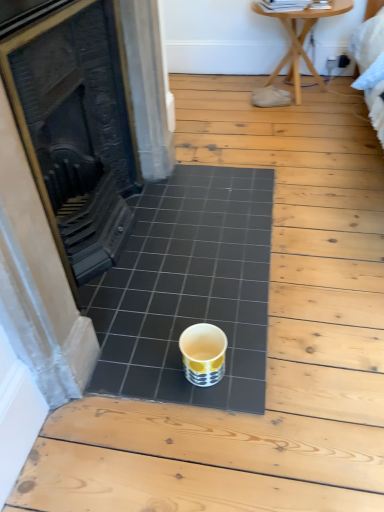
Question: Does black ceramic tile at center have a greater width compared to black cast iron fireplace at center?

Choices:
 (A) no
 (B) yes

Answer: (B)

Question: From the image's perspective, is black ceramic tile at center located beneath black cast iron fireplace at center?

Choices:
 (A) no
 (B) yes

Answer: (B)

Question: Does black ceramic tile at center have a smaller size compared to black cast iron fireplace at center?

Choices:
 (A) no
 (B) yes

Answer: (B)

Question: From the image's perspective, is black ceramic tile at center above black cast iron fireplace at center?

Choices:
 (A) yes
 (B) no

Answer: (B)

Question: Is black ceramic tile at center located outside black cast iron fireplace at center?

Choices:
 (A) no
 (B) yes

Answer: (B)

Question: From a real-world perspective, is black ceramic tile at center on black cast iron fireplace at center?

Choices:
 (A) no
 (B) yes

Answer: (A)

Question: Is the surface of yellow and white ceramic cup at center in direct contact with black ceramic tile at center?

Choices:
 (A) yes
 (B) no

Answer: (B)

Question: Can you confirm if yellow and white ceramic cup at center is thinner than black ceramic tile at center?

Choices:
 (A) yes
 (B) no

Answer: (A)

Question: Is the depth of yellow and white ceramic cup at center greater than that of black ceramic tile at center?

Choices:
 (A) no
 (B) yes

Answer: (A)

Question: Considering the relative sizes of yellow and white ceramic cup at center and black ceramic tile at center in the image provided, is yellow and white ceramic cup at center shorter than black ceramic tile at center?

Choices:
 (A) yes
 (B) no

Answer: (B)

Question: From the image's perspective, is yellow and white ceramic cup at center above black ceramic tile at center?

Choices:
 (A) yes
 (B) no

Answer: (B)

Question: Is yellow and white ceramic cup at center looking in the opposite direction of black ceramic tile at center?

Choices:
 (A) no
 (B) yes

Answer: (A)

Question: Considering the relative positions of wooden table at upper right and black ceramic tile at center in the image provided, is wooden table at upper right to the right of black ceramic tile at center from the viewer's perspective?

Choices:
 (A) no
 (B) yes

Answer: (B)